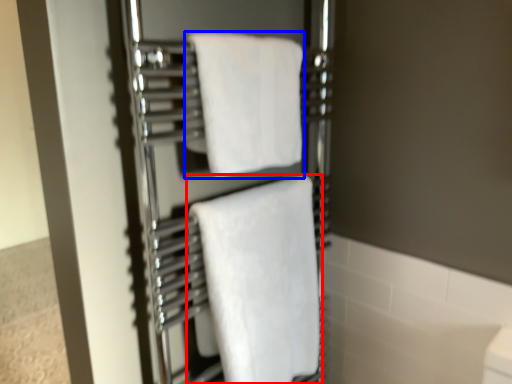
Question: Which point is closer to the camera, towel (highlighted by a red box) or towel (highlighted by a blue box)?

Choices:
 (A) towel
 (B) towel

Answer: (B)